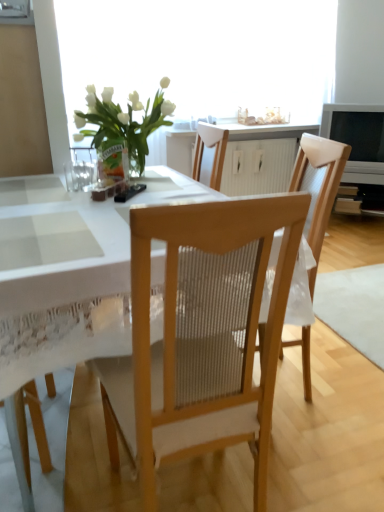
Locate an element on the screen. The image size is (384, 512). vacant area located to the right-hand side of wooden chair at center, which appears as the first chair when viewed from the back is located at coordinates (342, 380).